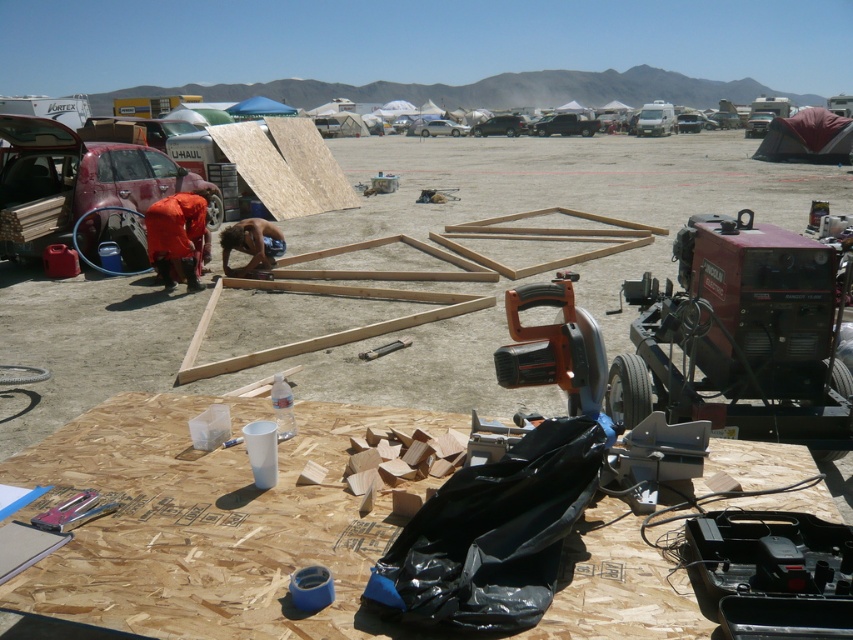
You are at a festival and need to move a heavy object from the black matte truck at center to the silver metallic car at center. Which vehicle should you load first to ensure the object ends up on top of the other?

The black matte truck at center is below the silver metallic car at center, so you should load the object onto the silver metallic car at center first, then onto the black matte truck at center to have it end up on top.

You are standing in the foreground of the work area at the festival. You see two points marked on the ground. The first point is at coordinates point (198, 208) and the second point is at point (415, 134). Which point is closer to you?

Point (198, 208) is closer to you because it is in front of point (415, 134).

You are standing at the center of the work area in the foreground. You need to locate the red cotton shirt at lower left. According to the coordinates provided, where exactly should you look to find it?

The red cotton shirt at lower left is located at coordinates point (177, 236), so you should look towards the lower left area of the work area to find it.